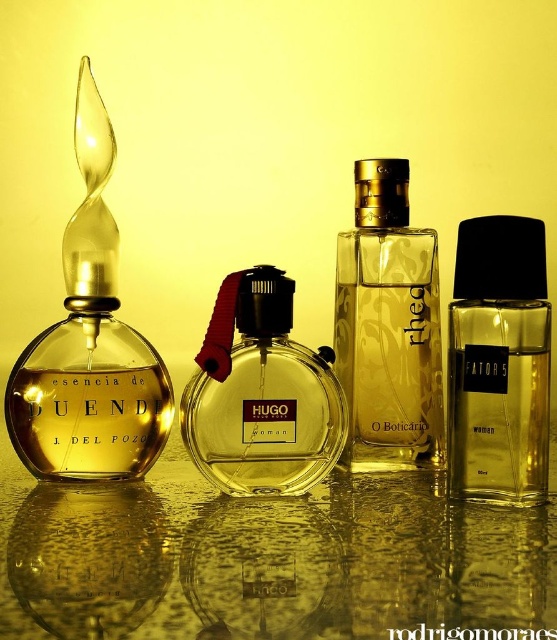
Question: Which of these objects is positioned closest to the transparent glass table at center?

Choices:
 (A) matte black perfume at center
 (B) transparent glass bottle at left
 (C) clear glass bottle at right
 (D) transparent glass bottle at center

Answer: (A)

Question: Which of the following is the closest to the observer?

Choices:
 (A) (398, 445)
 (B) (91, 419)
 (C) (458, 444)

Answer: (C)

Question: Can you confirm if transparent glass bottle at left is positioned below matte black perfume at center?

Choices:
 (A) yes
 (B) no

Answer: (B)

Question: Observing the image, what is the correct spatial positioning of transparent glass bottle at center in reference to matte black perfume at center?

Choices:
 (A) above
 (B) below

Answer: (A)

Question: Can you confirm if transparent glass bottle at center is smaller than matte black perfume at center?

Choices:
 (A) no
 (B) yes

Answer: (A)

Question: Which object is positioned closest to the clear glass bottle at right?

Choices:
 (A) transparent glass table at center
 (B) transparent glass bottle at left
 (C) matte black perfume at center
 (D) transparent glass bottle at center

Answer: (D)